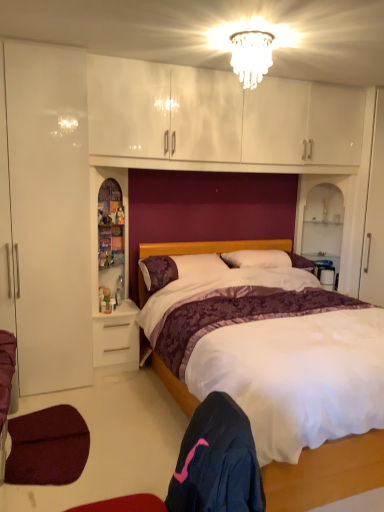
Question: Considering the positions of translucent plastic bottle at left and clear glass chandelier at upper center in the image, is translucent plastic bottle at left taller or shorter than clear glass chandelier at upper center?

Choices:
 (A) short
 (B) tall

Answer: (A)

Question: Considering their positions, is translucent plastic bottle at left located in front of or behind clear glass chandelier at upper center?

Choices:
 (A) front
 (B) behind

Answer: (B)

Question: Which object is positioned closest to the velvet dark red armchair at lower left?

Choices:
 (A) wooden shelf at left
 (B) purple satin pillow at center, acting as the 2th pillow starting from the left
 (C) clear glass chandelier at upper center
 (D) dark blue fabric at lower center
 (E) white satin bed at center

Answer: (D)

Question: Which object is the closest to the clear glass chandelier at upper center?

Choices:
 (A) white glossy drawer at lower left
 (B) velvet dark red armchair at lower left
 (C) white satin bed at center
 (D) dark blue fabric at lower center
 (E) purple textured pillow at center, the 2th pillow positioned from the right

Answer: (E)